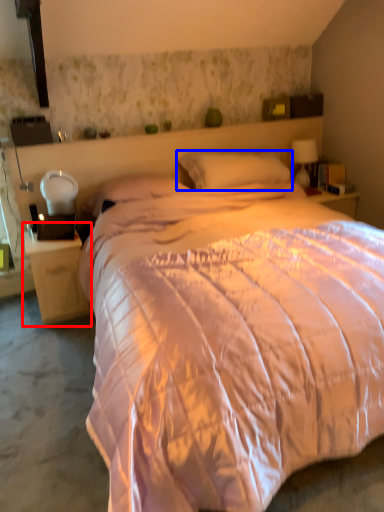
Question: Which of the following is the closest to the observer, nightstand (highlighted by a red box) or pillow (highlighted by a blue box)?

Choices:
 (A) nightstand
 (B) pillow

Answer: (A)